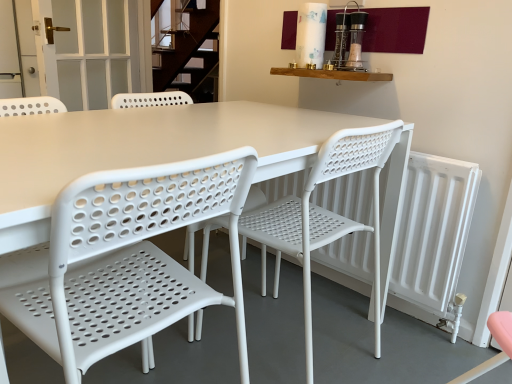
Question: Considering the relative sizes of white matte radiator at right and white plastic chair at center, placed as the first chair when sorted from left to right, in the image provided, is white matte radiator at right smaller than white plastic chair at center, placed as the first chair when sorted from left to right,?

Choices:
 (A) yes
 (B) no

Answer: (A)

Question: Is white matte radiator at right in front of white plastic chair at center, which ranks as the second chair in right-to-left order?

Choices:
 (A) yes
 (B) no

Answer: (B)

Question: Is white matte radiator at right aimed at white plastic chair at center, placed as the first chair when sorted from left to right?

Choices:
 (A) yes
 (B) no

Answer: (A)

Question: From a real-world perspective, is white matte radiator at right located higher than white plastic chair at center, placed as the first chair when sorted from left to right?

Choices:
 (A) no
 (B) yes

Answer: (A)

Question: Is white matte radiator at right with white plastic chair at center, placed as the first chair when sorted from left to right?

Choices:
 (A) yes
 (B) no

Answer: (B)

Question: Is white matte radiator at right oriented away from white plastic chair at center, which ranks as the second chair in right-to-left order?

Choices:
 (A) yes
 (B) no

Answer: (B)

Question: Is white frosted glass door at upper left shorter than white plastic chair at center, which ranks as the second chair in right-to-left order?

Choices:
 (A) yes
 (B) no

Answer: (A)

Question: Is white frosted glass door at upper left not near white plastic chair at center, placed as the first chair when sorted from left to right?

Choices:
 (A) no
 (B) yes

Answer: (B)

Question: From the image's perspective, is white frosted glass door at upper left located beneath white plastic chair at center, placed as the first chair when sorted from left to right?

Choices:
 (A) yes
 (B) no

Answer: (B)

Question: Can you confirm if white frosted glass door at upper left is thinner than white plastic chair at center, placed as the first chair when sorted from left to right?

Choices:
 (A) yes
 (B) no

Answer: (A)

Question: Is white frosted glass door at upper left to the left of white plastic chair at center, placed as the first chair when sorted from left to right, from the viewer's perspective?

Choices:
 (A) yes
 (B) no

Answer: (A)

Question: From the image's perspective, is white frosted glass door at upper left over white plastic chair at center, which ranks as the second chair in right-to-left order?

Choices:
 (A) yes
 (B) no

Answer: (A)

Question: Can you confirm if white matte radiator at right is positioned to the left of white plastic chair at center, placed as the 1th chair when sorted from right to left?

Choices:
 (A) yes
 (B) no

Answer: (B)